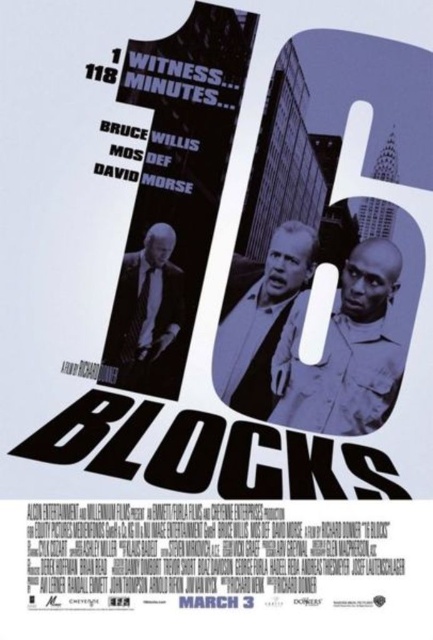
In the movie poster for 16 Blocks, where is the matte black shirt at center located?

The matte black shirt at center is located at point (x=345, y=353).

You are a costume designer analyzing the movie poster for spatial arrangement. Which suit, the gray matte suit at center or the matte black suit at lower left, has a greater width?

The gray matte suit at center has a greater width than the matte black suit at lower left.